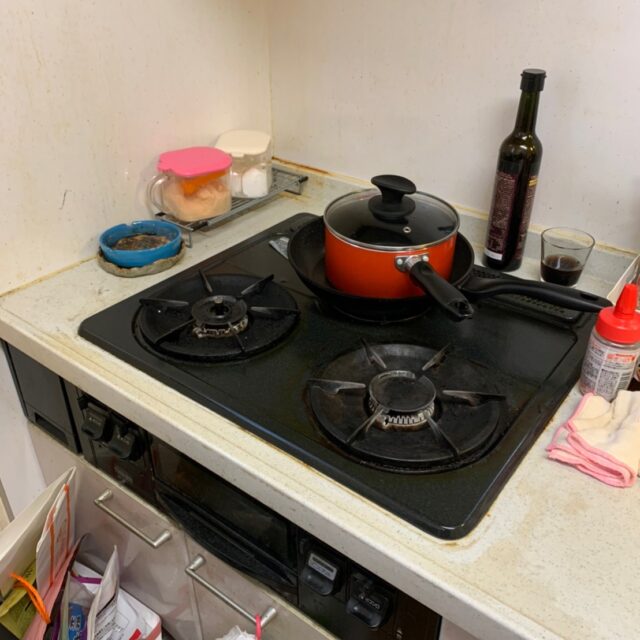
Find the location of `cabinet handles`. cabinet handles is located at coordinates (140, 532), (195, 576).